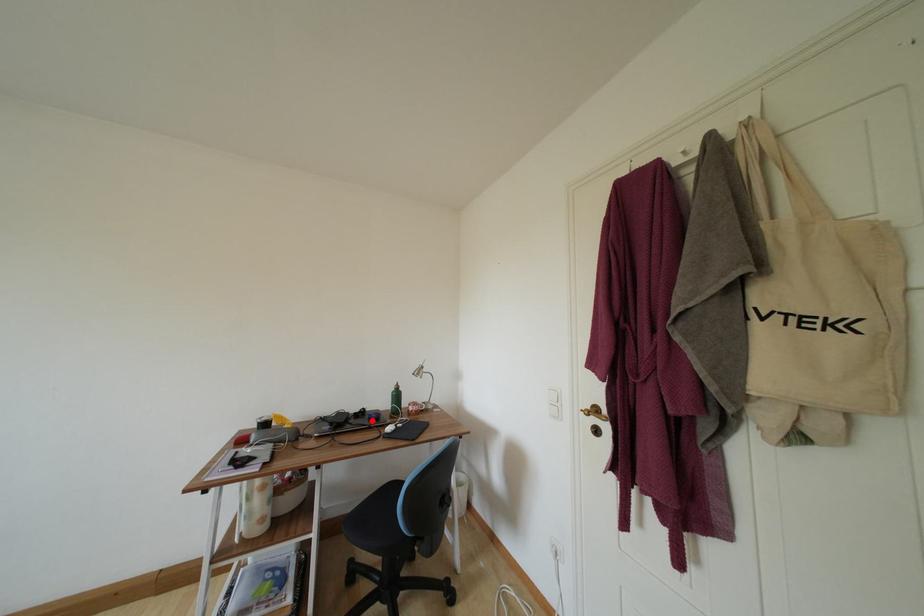
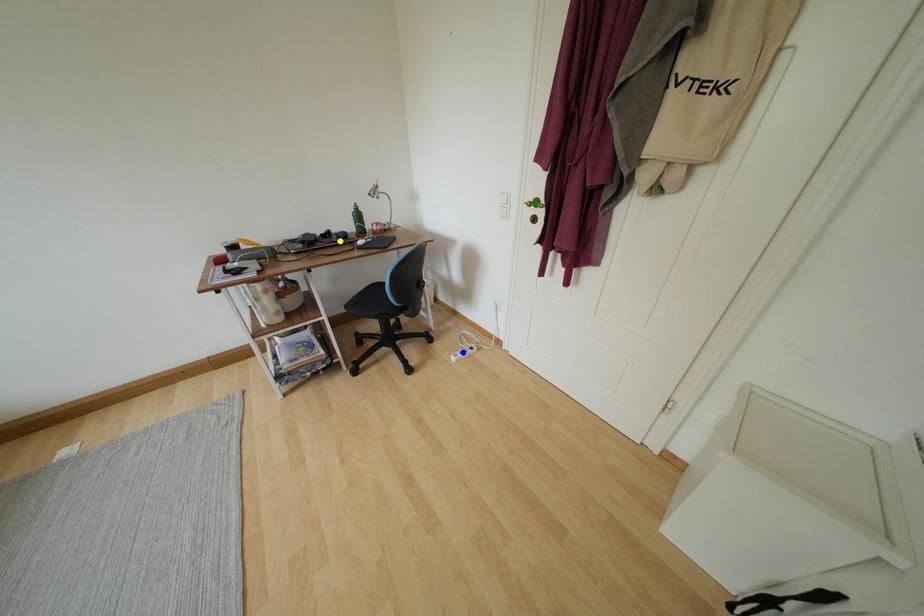
Question: I am providing you with two images of the same scene from different viewpoints. A red point is marked on the first image. You are given multiple points on the second image. In image 2, which mark is for the same physical point as the one in image 1?

Choices:
 (A) green point
 (B) yellow point
 (C) blue point

Answer: (B)